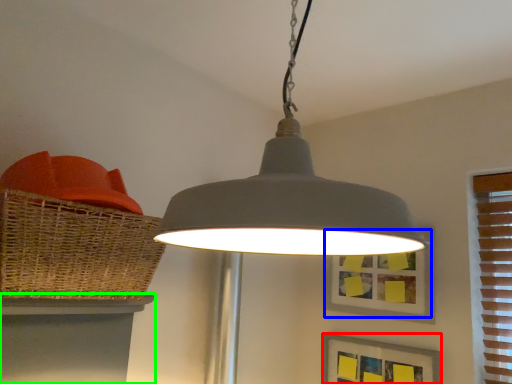
Question: Which object is positioned closest to picture frame (highlighted by a red box)? Select from picture frame (highlighted by a blue box) and table (highlighted by a green box).

Choices:
 (A) picture frame
 (B) table

Answer: (A)